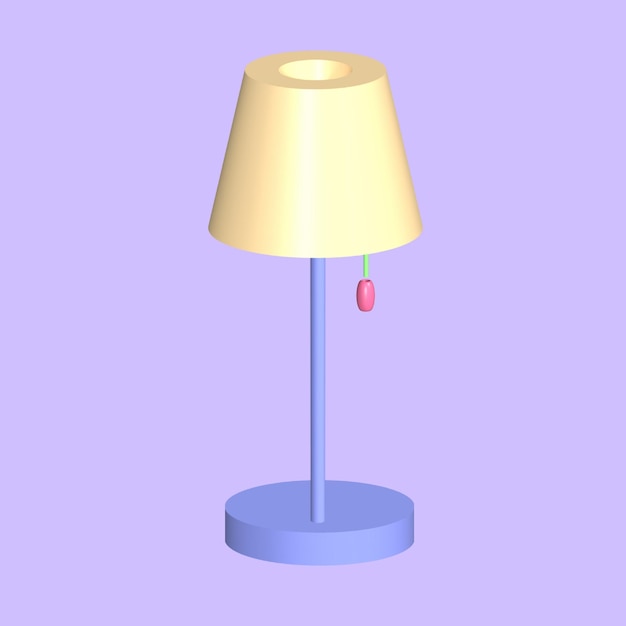
You are a GUI agent. You are given a task and a screenshot of the screen. Output one action in this format:
    pyautogui.click(x=<x>, y=<y>)
    Task: Click on the lamp base
    The height and width of the screenshot is (626, 626).
    Given the screenshot: What is the action you would take?
    pyautogui.click(x=337, y=535)